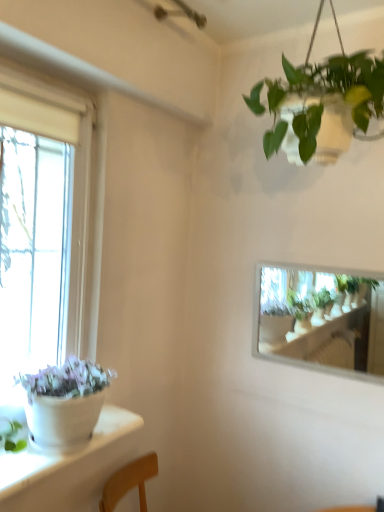
Question: Is green leafy plant at upper center, which is the second houseplant from back to front, thinner than green matte plant at upper right, the second houseplant in the front-to-back sequence?

Choices:
 (A) yes
 (B) no

Answer: (B)

Question: Does green leafy plant at upper center, which appears as the first houseplant when viewed from the top, have a greater height compared to green matte plant at upper right, which appears as the first houseplant when viewed from the back?

Choices:
 (A) yes
 (B) no

Answer: (A)

Question: Is green leafy plant at upper center, positioned as the first houseplant in front-to-back order, surrounding green matte plant at upper right, which is the 2th houseplant from top to bottom?

Choices:
 (A) yes
 (B) no

Answer: (B)

Question: Is green leafy plant at upper center, positioned as the first houseplant in front-to-back order, oriented away from green matte plant at upper right, the second houseplant in the front-to-back sequence?

Choices:
 (A) no
 (B) yes

Answer: (A)

Question: Is green leafy plant at upper center, positioned as the first houseplant in front-to-back order, in front of green matte plant at upper right, which is the 2th houseplant from top to bottom?

Choices:
 (A) no
 (B) yes

Answer: (B)

Question: Can you confirm if green leafy plant at upper center, which is the second houseplant from back to front, is positioned to the right of green matte plant at upper right, the second houseplant in the front-to-back sequence?

Choices:
 (A) no
 (B) yes

Answer: (A)

Question: Does green matte plant at upper right, the first houseplant in the bottom-to-top sequence, appear on the left side of green leafy plant at upper center, positioned as the first houseplant in front-to-back order?

Choices:
 (A) no
 (B) yes

Answer: (A)

Question: From a real-world perspective, is green matte plant at upper right, which is the 2th houseplant from top to bottom, physically below green leafy plant at upper center, which appears as the first houseplant when viewed from the top?

Choices:
 (A) no
 (B) yes

Answer: (B)

Question: Is green matte plant at upper right, which is the 2th houseplant from top to bottom, at the right side of green leafy plant at upper center, which is the second houseplant from back to front?

Choices:
 (A) yes
 (B) no

Answer: (A)

Question: Would you consider green matte plant at upper right, which is the 2th houseplant from top to bottom, to be distant from green leafy plant at upper center, which is the second houseplant in bottom-to-top order?

Choices:
 (A) no
 (B) yes

Answer: (B)

Question: From a real-world perspective, is green matte plant at upper right, which appears as the first houseplant when viewed from the back, over green leafy plant at upper center, which is the second houseplant from back to front?

Choices:
 (A) yes
 (B) no

Answer: (B)

Question: Is green leafy plant at upper center, positioned as the first houseplant in front-to-back order, located within green matte plant at upper right, the second houseplant in the front-to-back sequence?

Choices:
 (A) no
 (B) yes

Answer: (A)

Question: In the image, is green matte plant at upper right, which appears as the first houseplant when viewed from the back, positioned in front of or behind green leafy plant at upper center, which appears as the first houseplant when viewed from the top?

Choices:
 (A) front
 (B) behind

Answer: (B)